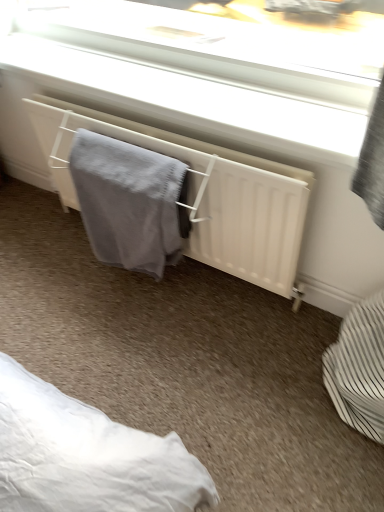
Where is `free space in front of white striped basket at lower right`? The image size is (384, 512). free space in front of white striped basket at lower right is located at coordinates (335, 467).